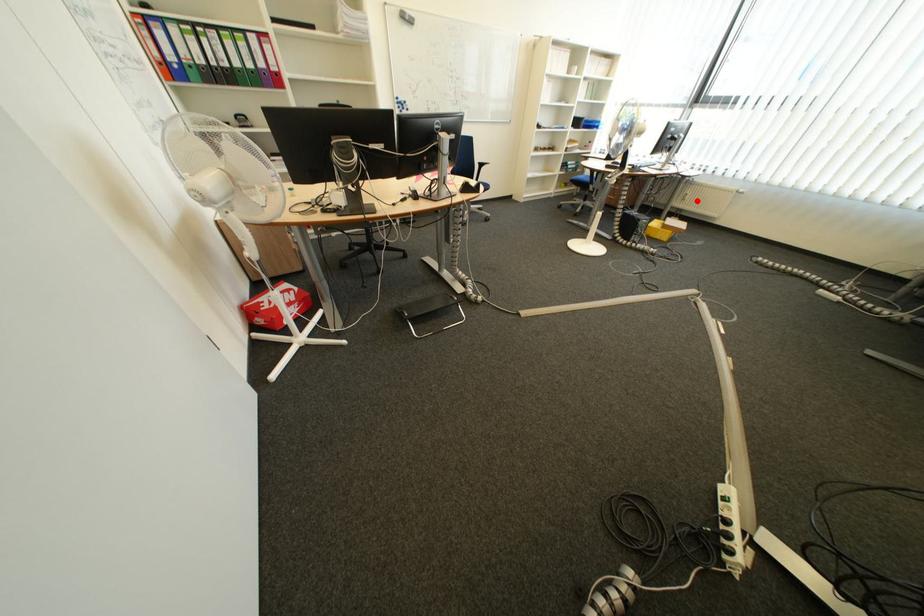
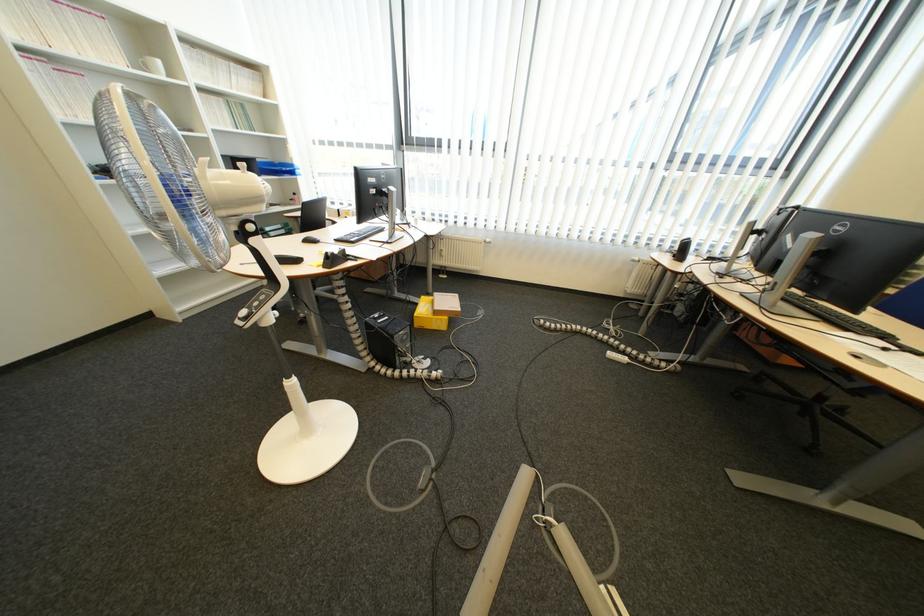
Question: I am providing you with two images of the same scene from different viewpoints. A red point is marked on the first image. At the location where the point appears in image 1, is it still visible in image 2?

Choices:
 (A) Yes
 (B) No

Answer: (A)